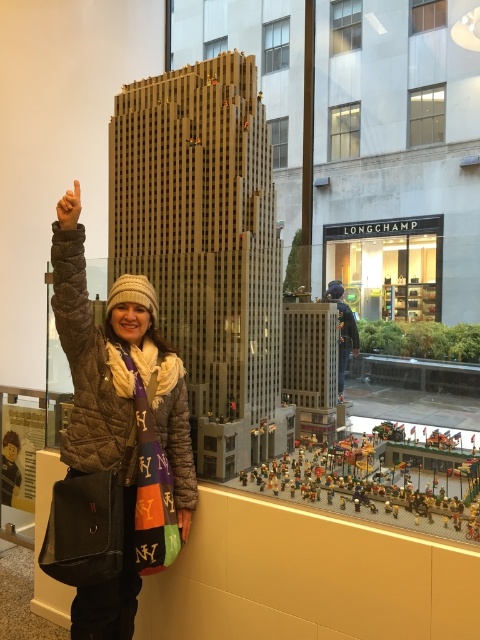
You are a photographer trying to capture the brown quilted jacket at left and the brown matte hand at upper left in a single shot. Which object is closer to your camera lens?

The brown quilted jacket at left is closer to the camera lens because it is further to the viewer than the brown matte hand at upper left.

You are an assistant helping someone choose between two brown fuzzy items in the exhibit. They ask which one is shorter. The items are the brown fuzzy coat at upper left and the brown fuzzy jacket at upper left. Which one should you tell them is shorter?

The brown fuzzy coat at upper left is shorter than the brown fuzzy jacket at upper left.

You are a photographer trying to capture a photo of the woman in the LEGO exhibit. You need to ensure that both the brown fuzzy coat at upper left and the matte black hand at upper left are in focus. Given that your camera can only focus on objects within a 90 cm range, will both objects be in focus?

The brown fuzzy coat at upper left and the matte black hand at upper left are 91.61 centimeters apart, which exceeds the camera focus range of 90 cm. Therefore, both objects cannot be in focus simultaneously.